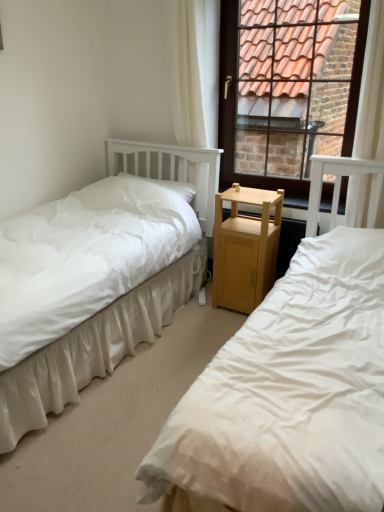
Question: From a real-world perspective, is white sheer curtain at upper right, which is the first curtain from right to left, physically located above or below white fabric curtain at upper center, placed as the second curtain when sorted from right to left?

Choices:
 (A) below
 (B) above

Answer: (B)

Question: Considering the positions of white sheer curtain at upper right, which is the first curtain from right to left, and white fabric curtain at upper center, placed as the second curtain when sorted from right to left, in the image, is white sheer curtain at upper right, which is the first curtain from right to left, taller or shorter than white fabric curtain at upper center, placed as the second curtain when sorted from right to left,?

Choices:
 (A) short
 (B) tall

Answer: (A)

Question: Which of these objects is positioned farthest from the white cotton bed at left, arranged as the 1th bed when viewed from the left?

Choices:
 (A) white fabric curtain at upper center, which is the first curtain from left to right
 (B) light brown wood nightstand at center
 (C) white soft pillow at center
 (D) brown wooden window at upper right
 (E) white sheer curtain at upper right, positioned as the second curtain in left-to-right order

Answer: (D)

Question: Which object is the farthest from the white cotton bed at left, arranged as the 1th bed when viewed from the left?

Choices:
 (A) white sheer curtain at upper right, which is the first curtain from right to left
 (B) light brown wood nightstand at center
 (C) brown wooden window at upper right
 (D) white fabric bed at left, which is the 2th bed in left-to-right order
 (E) white fabric curtain at upper center, which is the first curtain from left to right

Answer: (C)